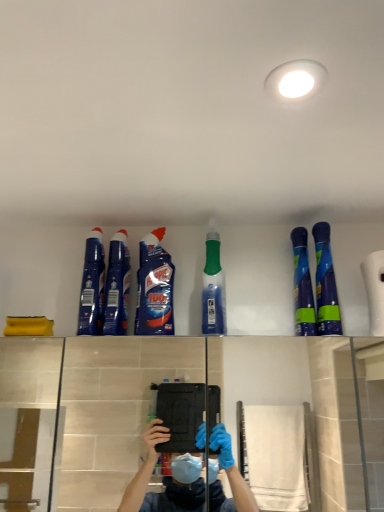
Question: Would you say blue glossy spray bottle at upper right, positioned as the first cleaning product in right-to-left order, is inside or outside blue glossy cleaner at center, acting as the second cleaning product starting from the left?

Choices:
 (A) inside
 (B) outside

Answer: (B)

Question: In the image, is blue glossy spray bottle at upper right, which is counted as the 6th cleaning product, starting from the left, positioned in front of or behind blue glossy cleaner at center, acting as the second cleaning product starting from the left?

Choices:
 (A) behind
 (B) front

Answer: (B)

Question: Estimate the real-world distances between objects in this image. Which object is closer to the blue glossy spray bottles at upper right, marked as the second cleaning product in a right-to-left arrangement?

Choices:
 (A) blue glossy cleaner at center, which appears as the fifth cleaning product when viewed from the right
 (B) blue glossy spray bottle at upper right, which is counted as the 6th cleaning product, starting from the left
 (C) green translucent bottle at center, marked as the fourth cleaning product in a left-to-right arrangement
 (D) blue glossy bottle at upper center, which ranks as the fourth cleaning product in right-to-left order
 (E) blue glossy cleaner at upper left, the 6th cleaning product when ordered from right to left

Answer: (B)

Question: Considering the real-world distances, which object is farthest from the blue glossy spray bottles at upper right, the fifth cleaning product from the left?

Choices:
 (A) blue glossy spray bottle at upper right, which is counted as the 6th cleaning product, starting from the left
 (B) blue glossy cleaner at upper left, the 6th cleaning product when ordered from right to left
 (C) blue glossy bottle at upper center, which ranks as the fourth cleaning product in right-to-left order
 (D) blue glossy cleaner at center, which appears as the fifth cleaning product when viewed from the right
 (E) green translucent bottle at center, marked as the fourth cleaning product in a left-to-right arrangement

Answer: (B)